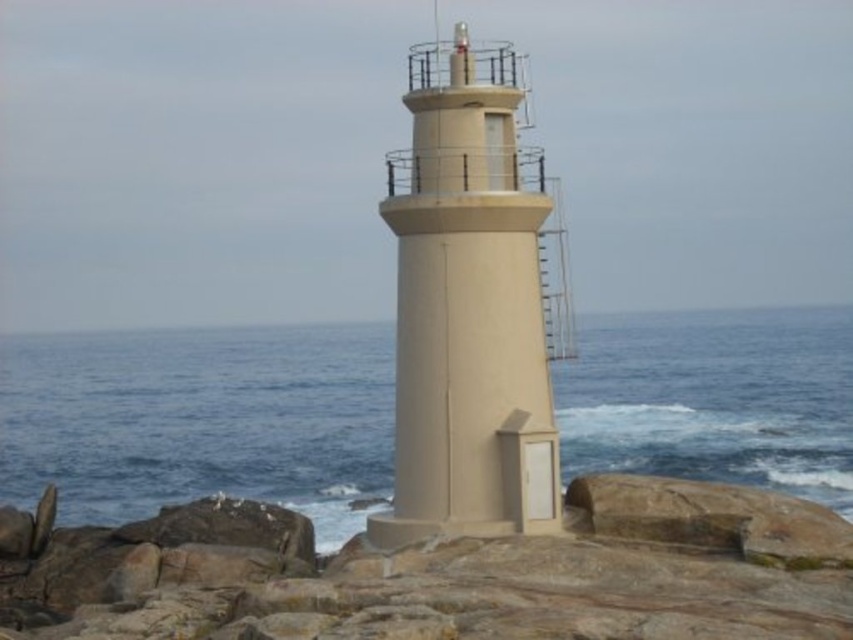
How far apart are blue water at center and beige concrete tower at center?

blue water at center and beige concrete tower at center are 60.92 meters apart.

From the picture: Can you confirm if blue water at center is smaller than beige concrete tower at center?

Incorrect, blue water at center is not smaller in size than beige concrete tower at center.

Between point (247, 442) and point (505, 401), which one is positioned in front?

Positioned in front is point (505, 401).

Where is `blue water at center`? blue water at center is located at coordinates (200, 420).

Between blue water at center and brown rock at center, which one has less height?

Standing shorter between the two is brown rock at center.

Locate an element on the screen. blue water at center is located at coordinates (200, 420).

Is point (666, 314) closer to viewer compared to point (225, 564)?

No, it is not.

The height and width of the screenshot is (640, 853). What are the coordinates of `blue water at center` in the screenshot? It's located at (200, 420).

Can you confirm if brown rock at center is shorter than beige concrete tower at center?

Indeed, brown rock at center has a lesser height compared to beige concrete tower at center.

Which of these two, brown rock at center or beige concrete tower at center, stands shorter?

brown rock at center is shorter.

Does point (300, 608) come behind point (564, 321)?

No, (300, 608) is in front of (564, 321).

The image size is (853, 640). In order to click on brown rock at center in this screenshot , I will do `click(450, 573)`.